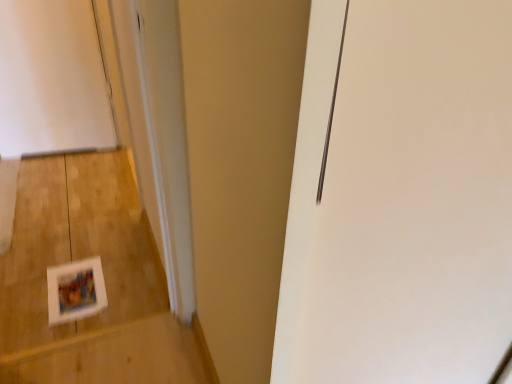
Find the location of `free space underneath matte white postcard at lower left (from a real-world perspective)`. free space underneath matte white postcard at lower left (from a real-world perspective) is located at coordinates (77, 283).